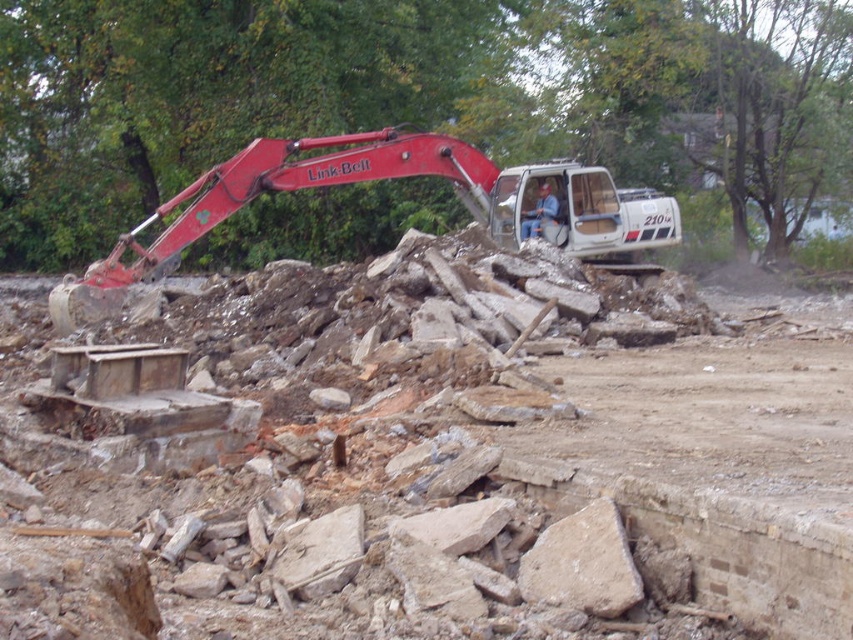
You are an inspector checking the construction site. You notice the rusty metal debris at center and the matte red excavator at upper left. Based on their positions, could the excavator at upper left be directly above the debris at center?

Yes, the rusty metal debris at center is positioned under the matte red excavator at upper left, so the excavator at upper left is directly above the debris at center.

You are a construction worker standing at the point labeled point (329,161). You need to move to point (547,212). Given the uneven ground and debris around you, is the path between these two points clear enough for safe passage?

The path between point (329,161) and point (547,212) is clear enough for safe passage since point (329,161) is in front of point (547,212), indicating they are aligned along the same line of sight without obstructions.

A surveyor is using a coordinate system to map the construction site. They need to locate the rusty metal debris at center. What are its coordinates?

The coordinates of the rusty metal debris at center are at point (445, 467).